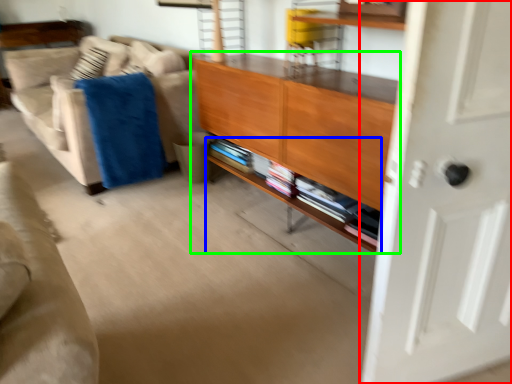
Question: Which is farther away from door (highlighted by a red box)? shelf (highlighted by a blue box) or cabinetry (highlighted by a green box)?

Choices:
 (A) shelf
 (B) cabinetry

Answer: (A)